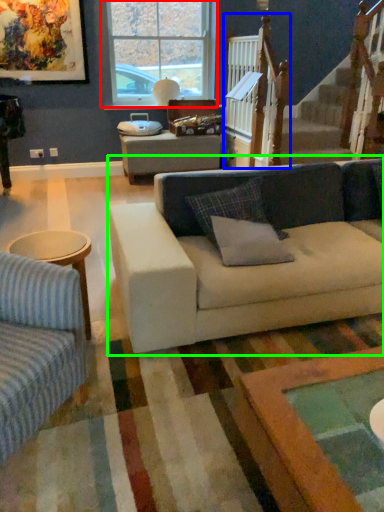
Question: Which object is positioned farthest from window (highlighted by a red box)? Select from rail (highlighted by a blue box) and studio couch (highlighted by a green box).

Choices:
 (A) rail
 (B) studio couch

Answer: (B)